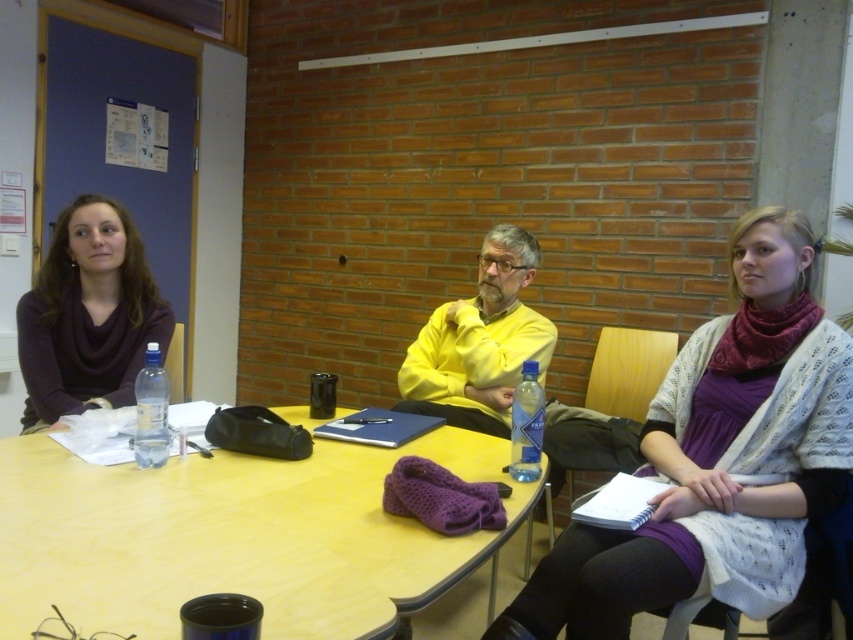
Question: Among these points, which one is farthest from the camera?

Choices:
 (A) (799, 532)
 (B) (521, 397)

Answer: (B)

Question: Which object appears farthest from the camera in this image?

Choices:
 (A) wooden table at center
 (B) yellow matte shirt at center
 (C) matte purple scarf at center

Answer: (B)

Question: Does clear plastic bottle at table center appear over blue plastic bottle at table center?

Choices:
 (A) yes
 (B) no

Answer: (A)

Question: From the image, what is the correct spatial relationship of matte purple scarf at center in relation to yellow matte shirt at center?

Choices:
 (A) left
 (B) right

Answer: (B)

Question: Does wooden table at center appear over yellow matte shirt at center?

Choices:
 (A) yes
 (B) no

Answer: (B)

Question: Which is nearer to the clear plastic bottle at table center?

Choices:
 (A) matte purple scarf at center
 (B) yellow matte shirt at center
 (C) blue plastic bottle at table center

Answer: (C)